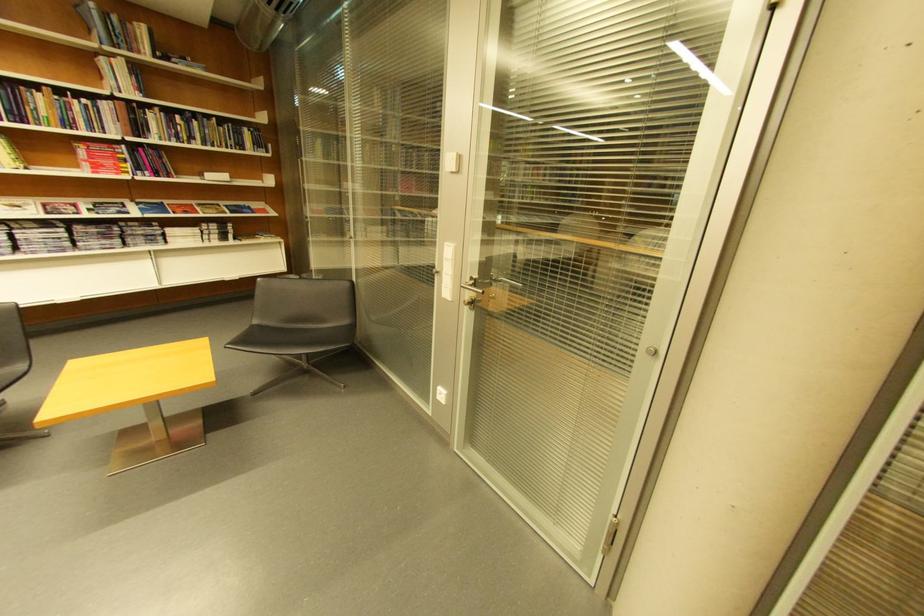
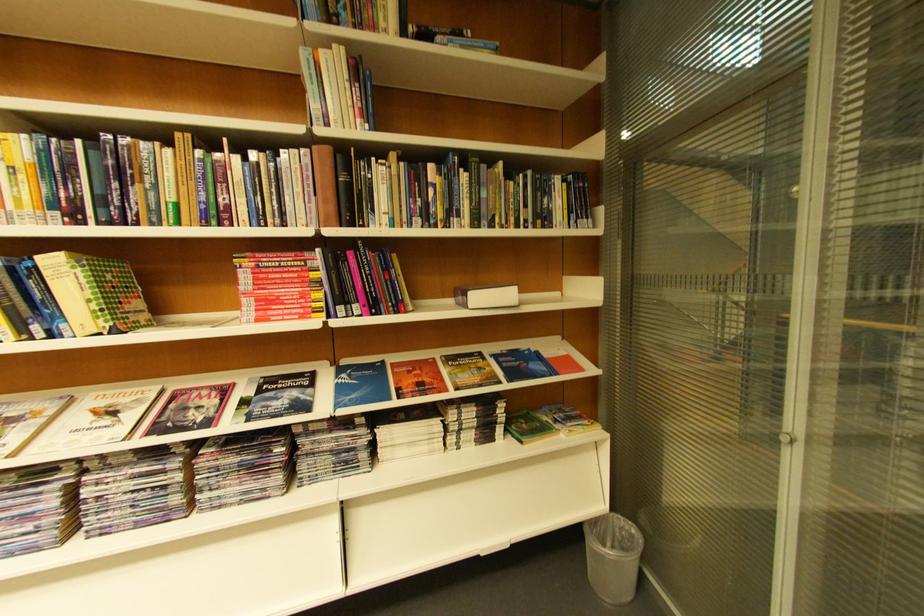
The point at (216, 180) is marked in the first image. Where is the corresponding point in the second image?

(480, 309)